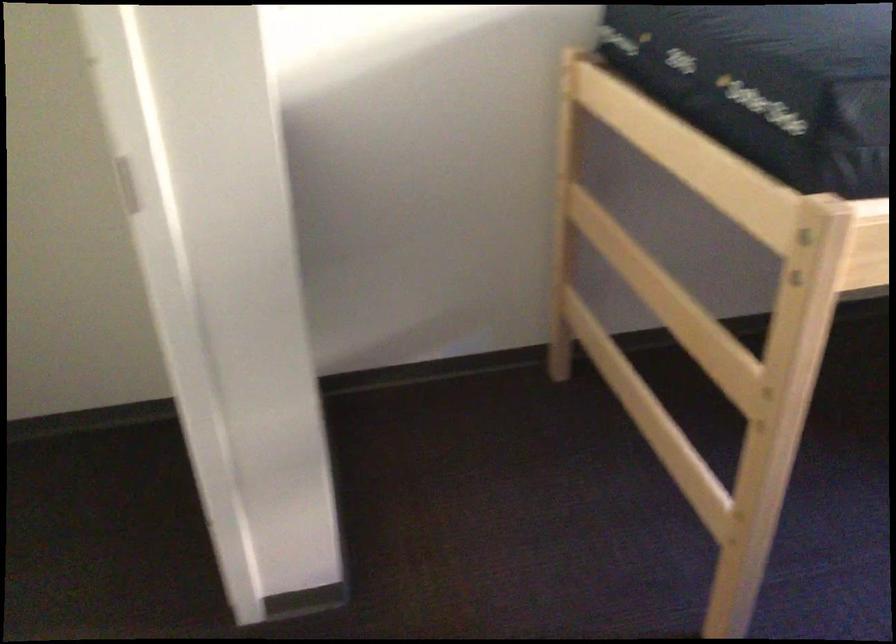
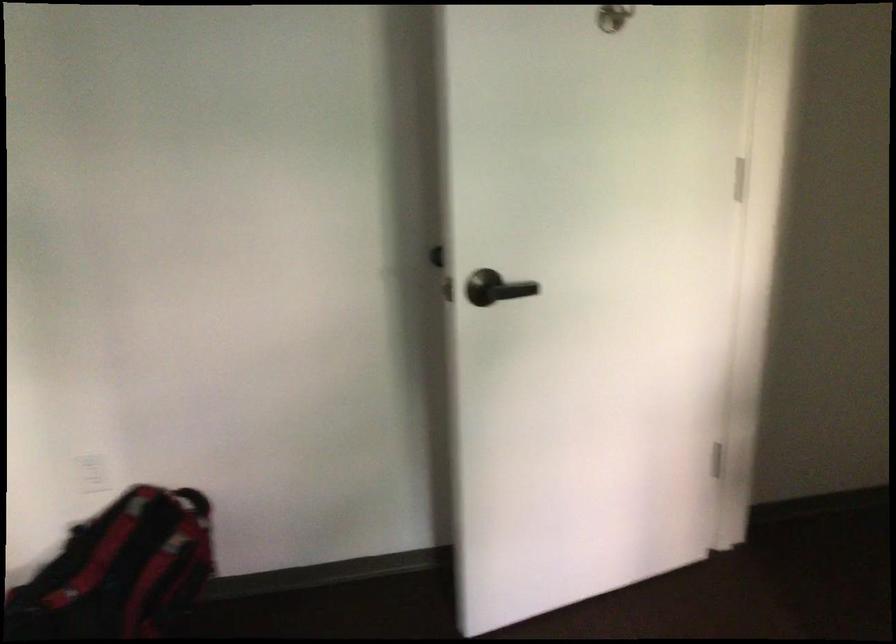
How did the camera likely rotate?

The camera rotated toward left-down.